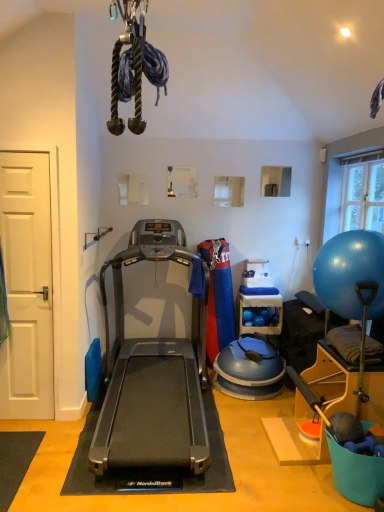
At what (x,y) coordinates should I click in order to perform the action: click on free spot in front of white matte door at left. Please return your answer as a coordinate pair (x, y). Looking at the image, I should click on (26, 430).